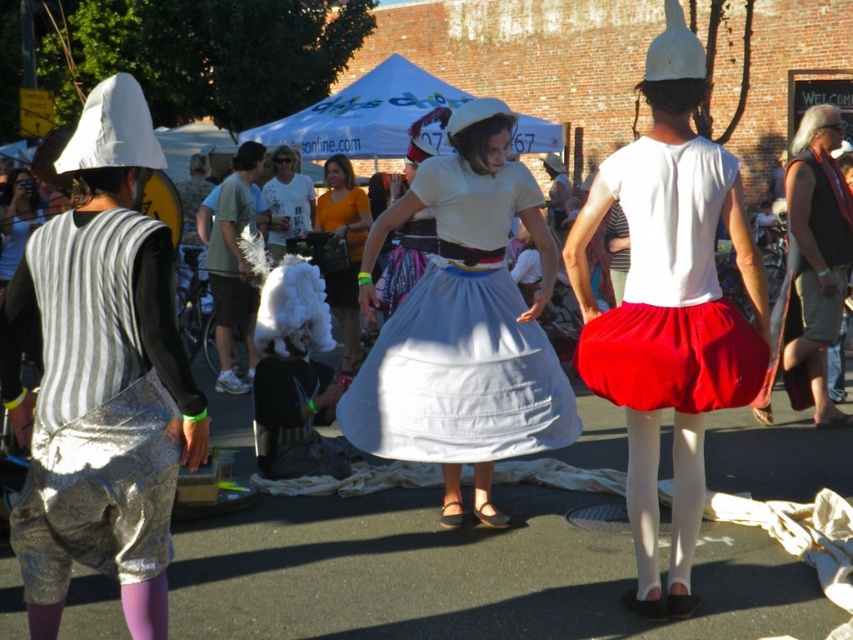
Between point (595, 352) and point (355, 332), which one is positioned in front?

Point (595, 352) is more forward.

Does matte white skirt at center have a greater width compared to orange t-shirt at center?

Indeed, matte white skirt at center has a greater width compared to orange t-shirt at center.

Which is in front, point (744, 288) or point (347, 284)?

Point (347, 284) is more forward.

You are a GUI agent. You are given a task and a screenshot of the screen. Output one action in this format:
    pyautogui.click(x=<x>, y=<y>)
    Task: Click on the matte white skirt at center
    The image size is (853, 640).
    Given the screenshot: What is the action you would take?
    pyautogui.click(x=669, y=307)

Between black leather tank top at right and white fluffy wig at center, which one has more height?

With more height is black leather tank top at right.

Who is shorter, black leather tank top at right or white fluffy wig at center?

white fluffy wig at center is shorter.

Is point (811, 120) farther from camera compared to point (236, 292)?

No, (811, 120) is in front of (236, 292).

Find the location of `black leather tank top at right`. black leather tank top at right is located at coordinates (810, 269).

What do you see at coordinates (671, 289) in the screenshot? Image resolution: width=853 pixels, height=640 pixels. I see `matte red skirt at center` at bounding box center [671, 289].

In the scene shown: Is matte red skirt at center further to camera compared to white fluffy wig at center?

No, matte red skirt at center is closer to the viewer.

Which is behind, point (677, 164) or point (225, 323)?

The point (225, 323) is more distant.

The width and height of the screenshot is (853, 640). Identify the location of matte red skirt at center. (671, 289).